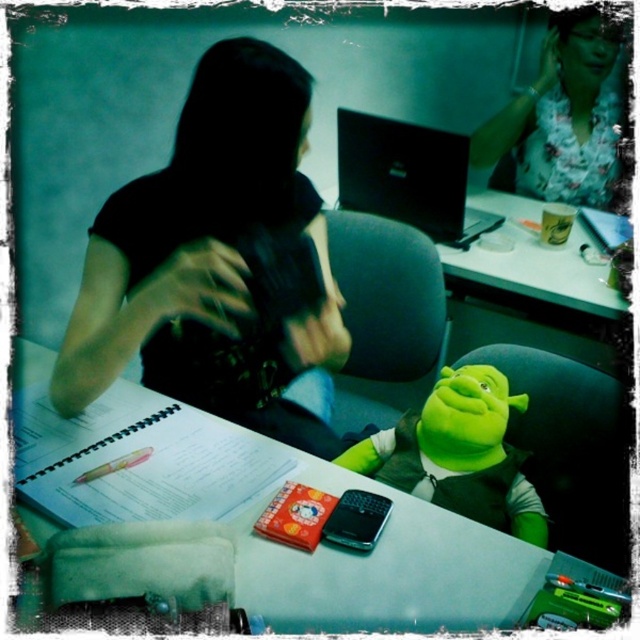
You are a person sitting at the desk in the image. You want to reach for an object located at point A and point B. Point A is at coordinate (x=333, y=365) and point B is at coordinate (x=621, y=216). Which point is closer to you?

Point A at coordinate (x=333, y=365) is closer to you because it is in front of point B at coordinate (x=621, y=216).

You are organizing items on a desk and need to place a matte black hoodie at upper left and a matte blue notepad at upper right. Based on the scene description, which item is located to the left of the other?

The matte black hoodie at upper left is positioned on the left side of matte blue notepad at upper right, so it is located to the left of the notepad.

You are organizing items on the desk and need to place a new item between the green plush toy at center and the matte blue notepad at upper right. Is there enough vertical space between them to fit a standard 10cm tall object?

The green plush toy at center is below the matte blue notepad at upper right, so there is vertical space between them. Since the object is only 10cm tall, it should fit between them.